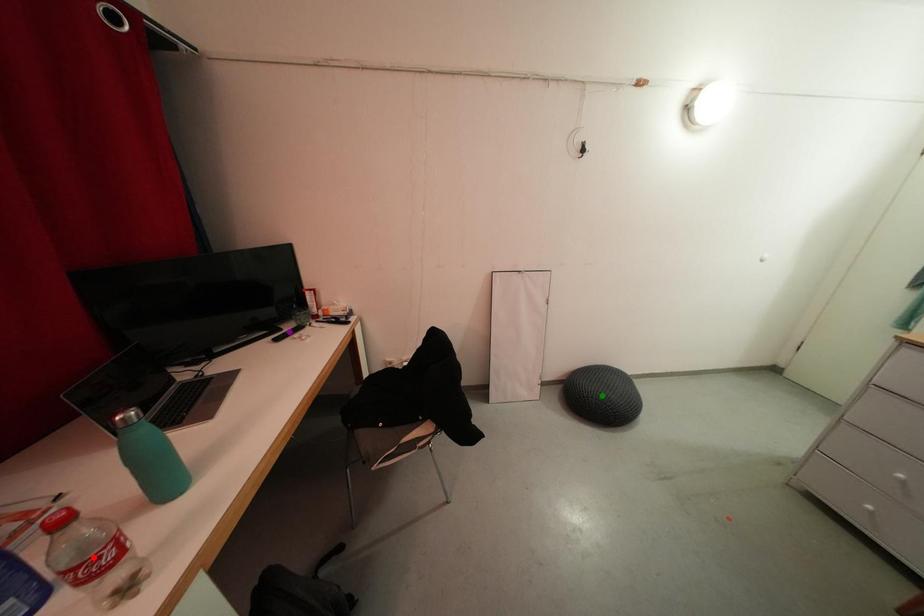
Order these from nearest to farthest:
green point
purple point
red point

red point < purple point < green point